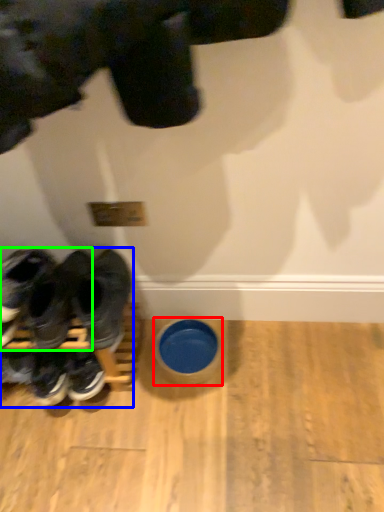
Question: Estimate the real-world distances between objects in this image. Which object is closer to bowl (highlighted by a red box), footwear (highlighted by a blue box) or footwear (highlighted by a green box)?

Choices:
 (A) footwear
 (B) footwear

Answer: (A)